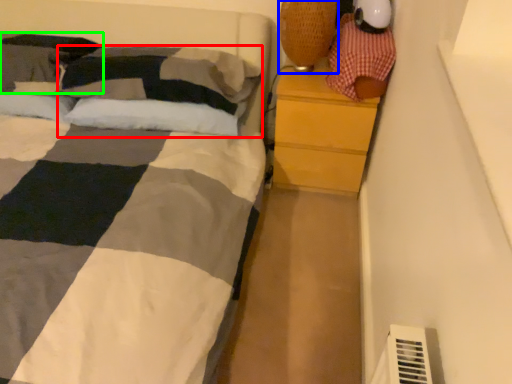
Question: Which object is the farthest from pillow (highlighted by a red box)? Choose among these: table lamp (highlighted by a blue box) or pillow (highlighted by a green box).

Choices:
 (A) table lamp
 (B) pillow

Answer: (A)